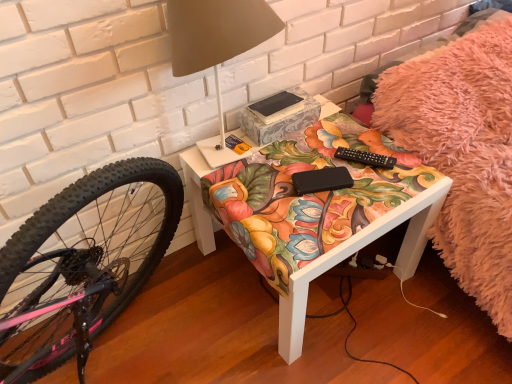
Find the location of a particular element. The height and width of the screenshot is (384, 512). spots to the right of matte white table lamp at upper center is located at coordinates (325, 157).